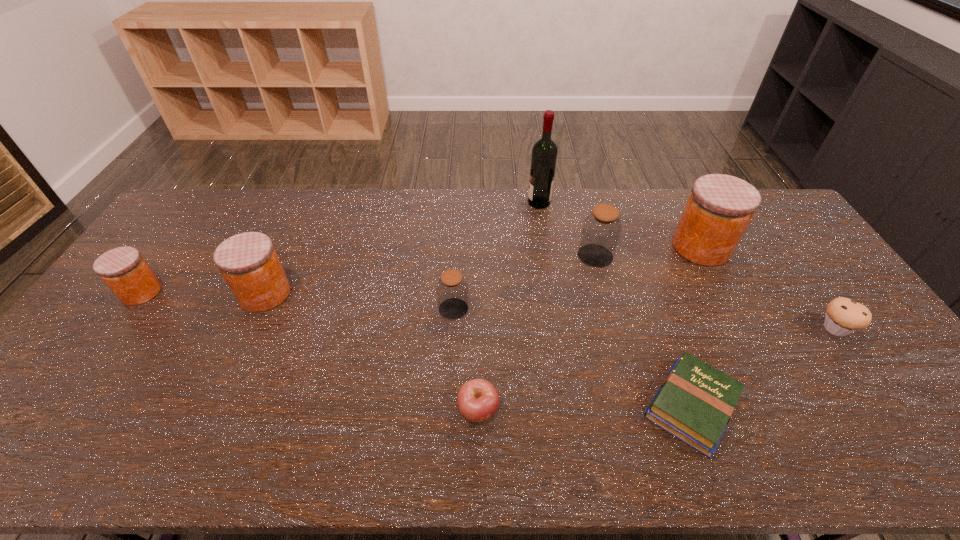
Find the location of a particular element. The height and width of the screenshot is (540, 960). the fifth object from right to left is located at coordinates (544, 153).

In order to click on the farthest object in this screenshot , I will do `click(544, 153)`.

At what (x,y) coordinates should I click in order to perform the action: click on the eighth shortest object. Please return your answer as a coordinate pair (x, y). Looking at the image, I should click on (720, 207).

This screenshot has width=960, height=540. Identify the location of the tallest jar. (720, 207).

What are the coordinates of `the second biggest orange jar` in the screenshot? It's located at (248, 261).

At what (x,y) coordinates should I click in order to perform the action: click on the fourth jar from right to left. Please return your answer as a coordinate pair (x, y). The image size is (960, 540). Looking at the image, I should click on (248, 261).

The width and height of the screenshot is (960, 540). I want to click on the second jar from right to left, so click(x=601, y=230).

This screenshot has width=960, height=540. Identify the location of the farther brown jar. (601, 230).

Locate an element on the screen. The height and width of the screenshot is (540, 960). the leftmost jar is located at coordinates (123, 269).

Locate an element on the screen. the leftmost object is located at coordinates (123, 269).